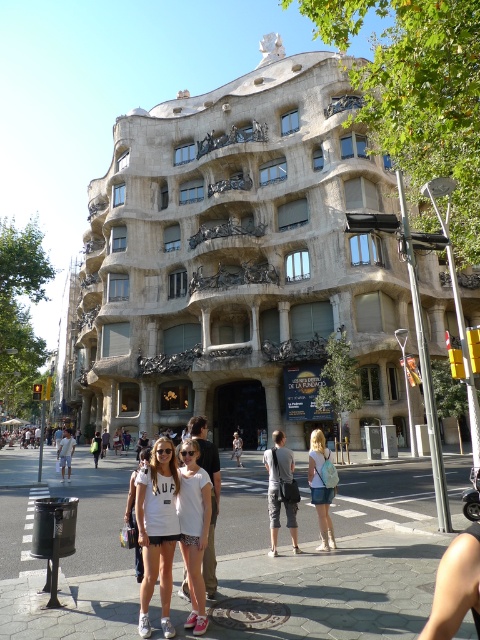
Identify the location of paved stone sidewalk at center. The width and height of the screenshot is (480, 640). [78, 509].

Is point (418, 480) closer to viewer compared to point (280, 451)?

No, it is behind (280, 451).

Which is behind, point (235, 520) or point (288, 528)?

Positioned behind is point (235, 520).

Identify the location of paved stone sidewalk at center. The height and width of the screenshot is (640, 480). (78, 509).

Is paved stone sidewalk at lower center wider than paved stone sidewalk at center?

No, paved stone sidewalk at lower center is not wider than paved stone sidewalk at center.

Which is in front, point (264, 588) or point (20, 531)?

Point (264, 588) is in front.

Measure the distance between paved stone sidewalk at lower center and camera.

28.40 meters

This screenshot has width=480, height=640. I want to click on paved stone sidewalk at lower center, so click(x=331, y=589).

From the picture: Is matte white t-shirt at center positioned in front of gray cotton shorts at center?

Yes, it is in front of gray cotton shorts at center.

Describe the element at coordinates (156, 531) in the screenshot. I see `matte white t-shirt at center` at that location.

The width and height of the screenshot is (480, 640). Find the location of `matte white t-shirt at center`. matte white t-shirt at center is located at coordinates (156, 531).